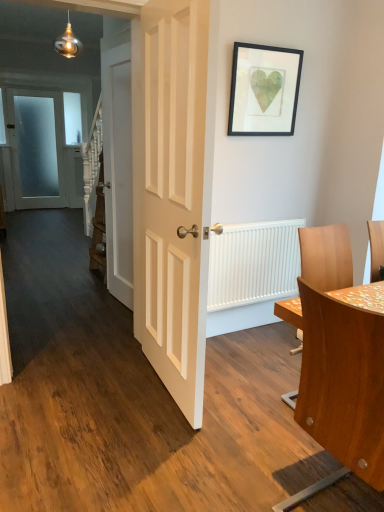
Locate an element on the screen. This screenshot has width=384, height=512. vacant space in front of white ribbed radiator at right is located at coordinates pos(259,353).